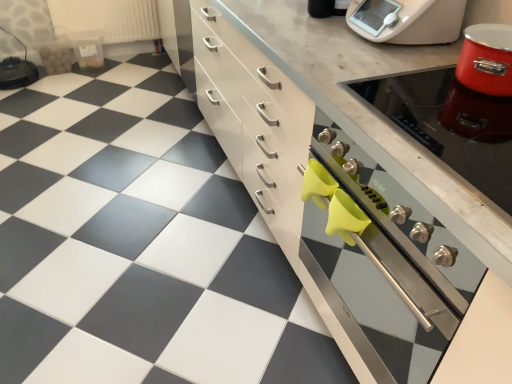
This screenshot has height=384, width=512. Find the location of `vacant area that lies in front of white plastic food processor at upper right`. vacant area that lies in front of white plastic food processor at upper right is located at coordinates click(x=390, y=62).